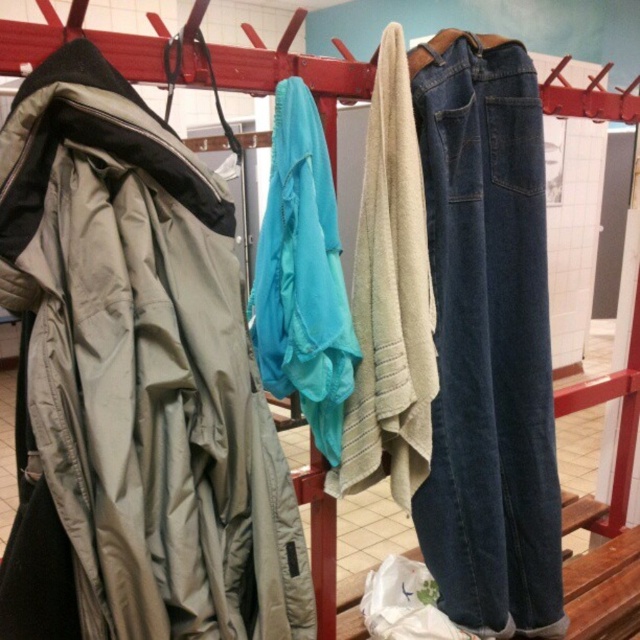
Question: Does matte khaki jacket at left appear under beige towel at center?

Choices:
 (A) no
 (B) yes

Answer: (B)

Question: Does denim at right have a lesser width compared to beige towel at center?

Choices:
 (A) yes
 (B) no

Answer: (B)

Question: Is matte khaki jacket at left bigger than denim at right?

Choices:
 (A) no
 (B) yes

Answer: (A)

Question: Which point is farther from the camera taking this photo?

Choices:
 (A) (355, 273)
 (B) (520, 378)
 (C) (285, 250)

Answer: (B)

Question: Which point appears closest to the camera in this image?

Choices:
 (A) (29, 627)
 (B) (413, 260)
 (C) (492, 589)

Answer: (A)

Question: Which of the following is the farthest from the observer?

Choices:
 (A) [216, 204]
 (B) [316, 244]
 (C) [355, 433]
 (D) [538, 262]

Answer: (D)